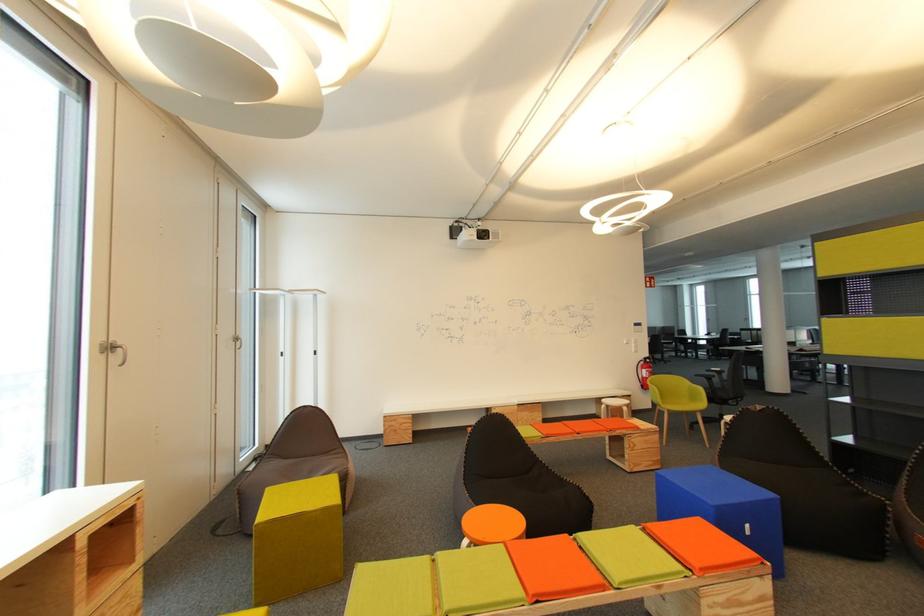
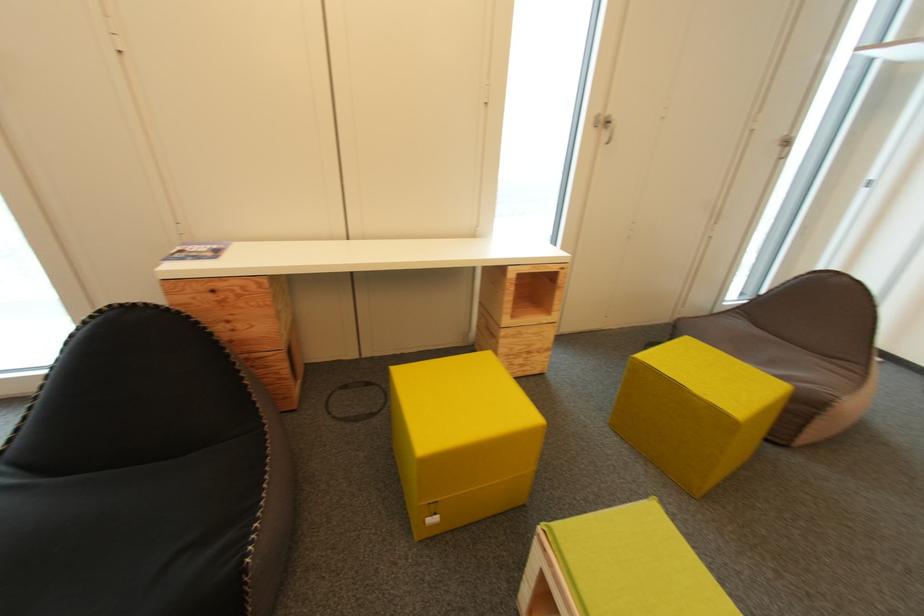
Based on the continuous images, in which direction is the camera rotating?

The rotation direction of the camera is left-down.